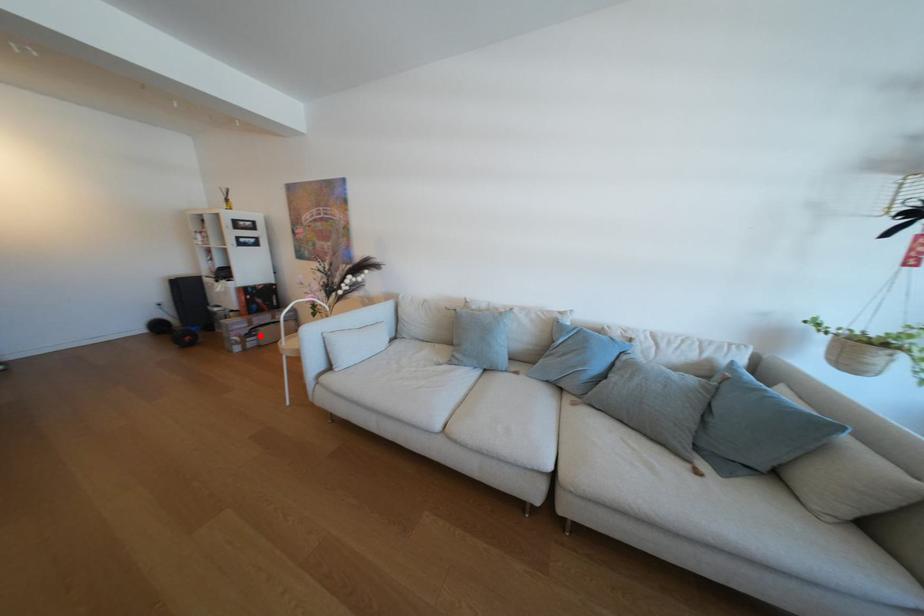
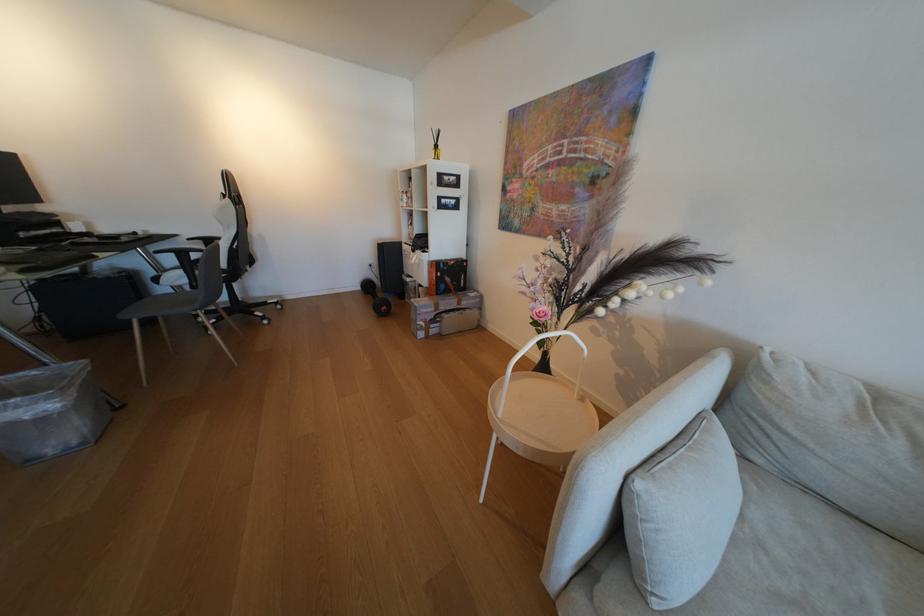
In the second image, find the point that corresponds to the highlighted location in the first image.

(444, 322)